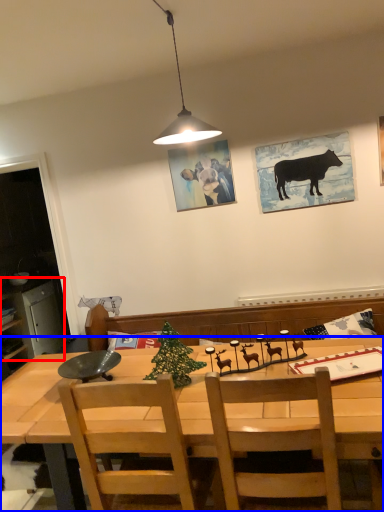
Question: Which point is closer to the camera, cabinetry (highlighted by a red box) or desk (highlighted by a blue box)?

Choices:
 (A) cabinetry
 (B) desk

Answer: (B)